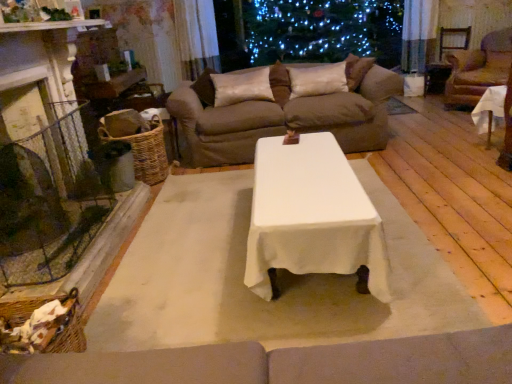
Image resolution: width=512 pixels, height=384 pixels. I want to click on vacant space that is to the left of white cloth-covered table at right, so 449,157.